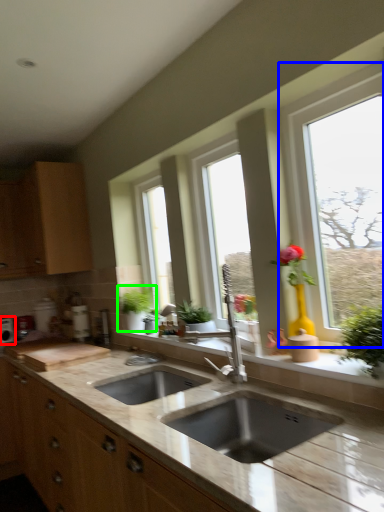
Question: Which is nearer to the appliance (highlighted by a red box)? window (highlighted by a blue box) or houseplant (highlighted by a green box).

Choices:
 (A) window
 (B) houseplant

Answer: (B)